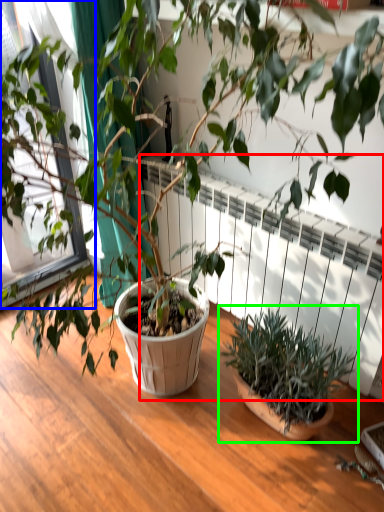
Question: Estimate the real-world distances between objects in this image. Which object is closer to radiator (highlighted by a red box), window frame (highlighted by a blue box) or houseplant (highlighted by a green box)?

Choices:
 (A) window frame
 (B) houseplant

Answer: (B)